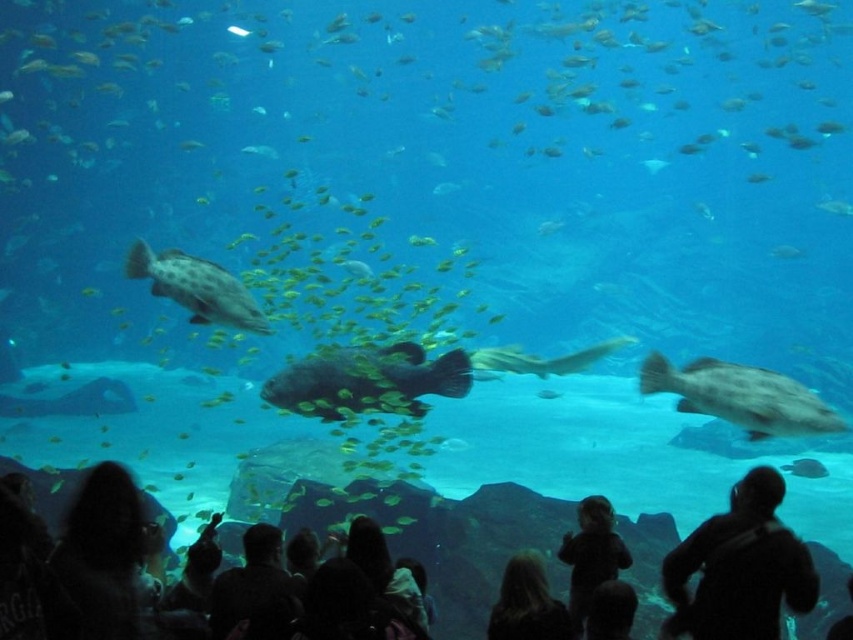
In the scene shown: You are a photographer standing in front of the aquarium. You want to take a photo of the blonde hair at lower center. Where should you position yourself to capture it best?

You should position yourself directly in front of the point at coordinates (527, 604) to best capture the blonde hair at lower center.

You are a marine biologist observing the aquarium. You need to place a 5 meter long safety barrier between the speckled gray fish at upper left and the smooth silver shark at center. Is this feasible given their current positions?

The distance between the speckled gray fish at upper left and the smooth silver shark at center is 4.88 meters. Since the safety barrier is 5 meters long, it would not fit between them as the distance is shorter than the barrier.